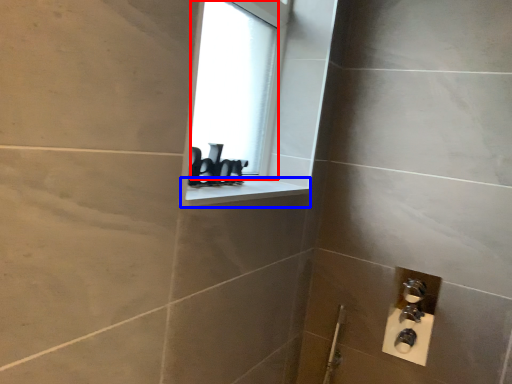
Question: Which of the following is the closest to the observer, window screen (highlighted by a red box) or window sill (highlighted by a blue box)?

Choices:
 (A) window screen
 (B) window sill

Answer: (B)